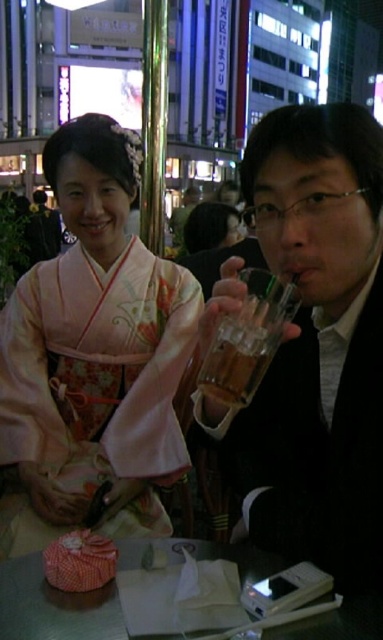
Question: Can you confirm if pink silk kimono at center is positioned below metallic silver phone at lower center?

Choices:
 (A) yes
 (B) no

Answer: (B)

Question: Estimate the real-world distances between objects in this image. Which object is closer to the translucent glass cup at upper center?

Choices:
 (A) metallic silver phone at lower center
 (B) clear glass cup at right

Answer: (B)

Question: Which object is farther from the camera taking this photo?

Choices:
 (A) translucent glass cup at upper center
 (B) clear glass cup at right
 (C) pink silk kimono at center

Answer: (C)

Question: Can you confirm if clear glass cup at right is bigger than metallic silver phone at lower center?

Choices:
 (A) yes
 (B) no

Answer: (A)

Question: Considering the real-world distances, which object is closest to the metallic silver phone at lower center?

Choices:
 (A) translucent glass cup at upper center
 (B) clear glass cup at right
 (C) pink silk kimono at center

Answer: (B)

Question: Does pink silk kimono at center have a greater width compared to metallic silver phone at lower center?

Choices:
 (A) yes
 (B) no

Answer: (A)